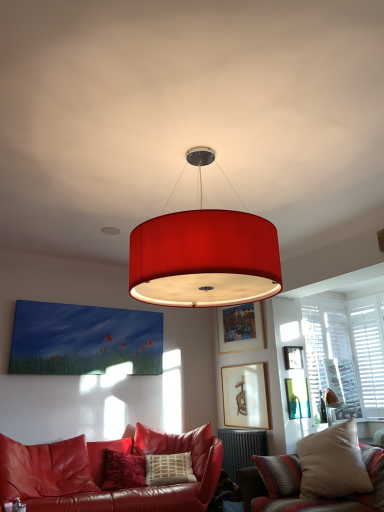
Where is `white wooden shutters at right`? The height and width of the screenshot is (512, 384). white wooden shutters at right is located at coordinates (346, 352).

I want to click on wooden picture frame at upper center, the second picture frame in the top-to-bottom sequence, so click(x=293, y=357).

Find the location of `matte red drum shade at center`. matte red drum shade at center is located at coordinates (204, 255).

From the picture: Considering the relative positions of wooden picture frame at upper center, which is the third picture frame in bottom-to-top order, and wooden picture frame at upper center, the 4th picture frame in the bottom-to-top sequence, in the image provided, is wooden picture frame at upper center, which is the third picture frame in bottom-to-top order, to the left of wooden picture frame at upper center, the 4th picture frame in the bottom-to-top sequence, from the viewer's perspective?

No.

Which of these two, wooden picture frame at upper center, the second picture frame in the top-to-bottom sequence, or wooden picture frame at upper center, the 4th picture frame in the bottom-to-top sequence, stands taller?

wooden picture frame at upper center, the 4th picture frame in the bottom-to-top sequence.

Is wooden picture frame at upper center, the second picture frame in the top-to-bottom sequence, placed right next to wooden picture frame at upper center, the 1th picture frame when ordered from top to bottom?

No, wooden picture frame at upper center, the second picture frame in the top-to-bottom sequence, is not beside wooden picture frame at upper center, the 1th picture frame when ordered from top to bottom.

At what (x,y) coordinates should I click in order to perform the action: click on studio couch that is on the left side of dark gray metallic radiator at lower center. Please return your answer as a coordinate pair (x, y). Image resolution: width=384 pixels, height=512 pixels. Looking at the image, I should click on (102, 474).

From the image's perspective, which one is positioned lower, dark gray metallic radiator at lower center or satin red couch at lower left, which is the 2th studio couch from right to left?

dark gray metallic radiator at lower center.

In terms of size, does dark gray metallic radiator at lower center appear bigger or smaller than satin red couch at lower left, which is the 2th studio couch from right to left?

In the image, dark gray metallic radiator at lower center appears to be smaller than satin red couch at lower left, which is the 2th studio couch from right to left.

Would you say dark gray metallic radiator at lower center contains satin red couch at lower left, the first studio couch in the left-to-right sequence?

Actually, satin red couch at lower left, the first studio couch in the left-to-right sequence, is outside dark gray metallic radiator at lower center.

Is wooden picture frame at upper center, the 1th picture frame when ordered from top to bottom, oriented away from satin red couch at lower left, which is the 2th studio couch from right to left?

wooden picture frame at upper center, the 1th picture frame when ordered from top to bottom, does not have its back to satin red couch at lower left, which is the 2th studio couch from right to left.

Can you confirm if wooden picture frame at upper center, the 1th picture frame when ordered from top to bottom, is positioned to the left of satin red couch at lower left, the first studio couch in the left-to-right sequence?

No.

Considering the relative sizes of wooden picture frame at upper center, the 1th picture frame when ordered from top to bottom, and satin red couch at lower left, which is the 2th studio couch from right to left, in the image provided, is wooden picture frame at upper center, the 1th picture frame when ordered from top to bottom, bigger than satin red couch at lower left, which is the 2th studio couch from right to left,?

Incorrect, wooden picture frame at upper center, the 1th picture frame when ordered from top to bottom, is not larger than satin red couch at lower left, which is the 2th studio couch from right to left.

From a real-world perspective, does wooden picture frame at upper center, the 4th picture frame in the bottom-to-top sequence, stand above satin red couch at lower left, the first studio couch in the left-to-right sequence?

Correct, in the physical world, wooden picture frame at upper center, the 4th picture frame in the bottom-to-top sequence, is higher than satin red couch at lower left, the first studio couch in the left-to-right sequence.

Is matte gold picture frame at upper right, the 3th picture frame when ordered from top to bottom, next to matte wooden picture frame at center, which is counted as the 4th picture frame, starting from the top?

No, matte gold picture frame at upper right, the 3th picture frame when ordered from top to bottom, is not with matte wooden picture frame at center, which is counted as the 4th picture frame, starting from the top.

This screenshot has width=384, height=512. Find the location of `picture frame in front of the matte wooden picture frame at center, which is counted as the 4th picture frame, starting from the top`. picture frame in front of the matte wooden picture frame at center, which is counted as the 4th picture frame, starting from the top is located at coordinates (297, 398).

Considering their positions, is matte gold picture frame at upper right, the 3th picture frame when ordered from top to bottom, located in front of or behind matte wooden picture frame at center, the 1th picture frame in the bottom-to-top sequence?

Clearly, matte gold picture frame at upper right, the 3th picture frame when ordered from top to bottom, is in front of matte wooden picture frame at center, the 1th picture frame in the bottom-to-top sequence.

Could you measure the distance between matte gold picture frame at upper right, which is the 2th picture frame from bottom to top, and matte wooden picture frame at center, which is counted as the 4th picture frame, starting from the top?

They are 17.87 inches apart.

Is wooden picture frame at upper center, which is the third picture frame in bottom-to-top order, at the left side of dark gray metallic radiator at lower center?

In fact, wooden picture frame at upper center, which is the third picture frame in bottom-to-top order, is to the right of dark gray metallic radiator at lower center.

From the image's perspective, is wooden picture frame at upper center, which is the third picture frame in bottom-to-top order, positioned above or below dark gray metallic radiator at lower center?

Based on their image positions, wooden picture frame at upper center, which is the third picture frame in bottom-to-top order, is located above dark gray metallic radiator at lower center.

You are a GUI agent. You are given a task and a screenshot of the screen. Output one action in this format:
    pyautogui.click(x=<x>, y=<y>)
    Task: Click on the 3rd picture frame directly above the dark gray metallic radiator at lower center (from a real-world perspective)
    This screenshot has height=512, width=384.
    Given the screenshot: What is the action you would take?
    pyautogui.click(x=293, y=357)

In terms of width, does wooden picture frame at upper center, the second picture frame in the top-to-bottom sequence, look wider or thinner when compared to dark gray metallic radiator at lower center?

wooden picture frame at upper center, the second picture frame in the top-to-bottom sequence, is thinner than dark gray metallic radiator at lower center.

Is point (340, 321) positioned before point (235, 349)?

No, (340, 321) is behind (235, 349).

Between white wooden shutters at right and wooden picture frame at upper center, the 1th picture frame when ordered from top to bottom, which one has larger width?

white wooden shutters at right.

Identify the location of window below the wooden picture frame at upper center, the 1th picture frame when ordered from top to bottom (from a real-world perspective). The image size is (384, 512). (346, 352).

Can you confirm if white wooden shutters at right is positioned to the right of wooden picture frame at upper center, the 1th picture frame when ordered from top to bottom?

Indeed, white wooden shutters at right is positioned on the right side of wooden picture frame at upper center, the 1th picture frame when ordered from top to bottom.

From a real-world perspective, is wooden picture frame at upper center, the 4th picture frame in the bottom-to-top sequence, physically above matte gold picture frame at upper right, the 3th picture frame when ordered from top to bottom?

Indeed, from a real-world perspective, wooden picture frame at upper center, the 4th picture frame in the bottom-to-top sequence, stands above matte gold picture frame at upper right, the 3th picture frame when ordered from top to bottom.

Considering the relative positions of wooden picture frame at upper center, the 1th picture frame when ordered from top to bottom, and matte gold picture frame at upper right, which is the 2th picture frame from bottom to top, in the image provided, is wooden picture frame at upper center, the 1th picture frame when ordered from top to bottom, in front of matte gold picture frame at upper right, which is the 2th picture frame from bottom to top,?

No, the depth of wooden picture frame at upper center, the 1th picture frame when ordered from top to bottom, is greater than that of matte gold picture frame at upper right, which is the 2th picture frame from bottom to top.

Is point (258, 312) positioned in front of point (293, 392)?

No, it is behind (293, 392).

You are a GUI agent. You are given a task and a screenshot of the screen. Output one action in this format:
    pyautogui.click(x=<x>, y=<y>)
    Task: Click on the 1st picture frame positioned below the wooden picture frame at upper center, the 4th picture frame in the bottom-to-top sequence (from a real-world perspective)
    
    Given the screenshot: What is the action you would take?
    pyautogui.click(x=293, y=357)

Identify the location of radiator located behind the satin red couch at lower left, the first studio couch in the left-to-right sequence. Image resolution: width=384 pixels, height=512 pixels. (241, 448).

Considering their positions, is matte gold picture frame at upper right, which is the 2th picture frame from bottom to top, positioned further to white wooden shutters at right than velvet beige pillow at lower right, the second studio couch viewed from the left?

velvet beige pillow at lower right, the second studio couch viewed from the left, is positioned further to the anchor white wooden shutters at right.

Considering their positions, is wooden picture frame at upper center, the second picture frame in the top-to-bottom sequence, positioned further to dark gray metallic radiator at lower center than matte gold picture frame at upper right, the 3th picture frame when ordered from top to bottom?

Based on the image, wooden picture frame at upper center, the second picture frame in the top-to-bottom sequence, appears to be further to dark gray metallic radiator at lower center.

When comparing their distances from white wooden shutters at right, does matte gold picture frame at upper right, the 3th picture frame when ordered from top to bottom, or wooden picture frame at upper center, the 1th picture frame when ordered from top to bottom, seem further?

Based on the image, wooden picture frame at upper center, the 1th picture frame when ordered from top to bottom, appears to be further to white wooden shutters at right.

When comparing their distances from white wooden shutters at right, does matte wooden picture frame at center, which is counted as the 4th picture frame, starting from the top, or dark gray metallic radiator at lower center seem closer?

matte wooden picture frame at center, which is counted as the 4th picture frame, starting from the top, is closer to white wooden shutters at right.

Based on their spatial positions, is matte gold picture frame at upper right, the 3th picture frame when ordered from top to bottom, or dark gray metallic radiator at lower center closer to wooden picture frame at upper center, the second picture frame in the top-to-bottom sequence?

matte gold picture frame at upper right, the 3th picture frame when ordered from top to bottom, is positioned closer to the anchor wooden picture frame at upper center, the second picture frame in the top-to-bottom sequence.

Which object lies further to the anchor point matte wooden picture frame at center, which is counted as the 4th picture frame, starting from the top, matte gold picture frame at upper right, which is the 2th picture frame from bottom to top, or wooden picture frame at upper center, the 1th picture frame when ordered from top to bottom?

wooden picture frame at upper center, the 1th picture frame when ordered from top to bottom.

Estimate the real-world distances between objects in this image. Which object is closer to velvet beige pillow at lower right, the second studio couch viewed from the left, dark gray metallic radiator at lower center or matte gold picture frame at upper right, the 3th picture frame when ordered from top to bottom?

dark gray metallic radiator at lower center.

Estimate the real-world distances between objects in this image. Which object is closer to satin red couch at lower left, which is the 2th studio couch from right to left, velvet beige pillow at lower right, which ranks as the first studio couch in right-to-left order, or white wooden shutters at right?

velvet beige pillow at lower right, which ranks as the first studio couch in right-to-left order, is closer to satin red couch at lower left, which is the 2th studio couch from right to left.

Locate an element on the screen. This screenshot has width=384, height=512. studio couch between satin red couch at lower left, which is the 2th studio couch from right to left, and wooden picture frame at upper center, the second picture frame in the top-to-bottom sequence, from left to right is located at coordinates (318, 475).

You are a GUI agent. You are given a task and a screenshot of the screen. Output one action in this format:
    pyautogui.click(x=<x>, y=<y>)
    Task: Click on the studio couch located between velvet beige pillow at lower right, the second studio couch viewed from the left, and wooden picture frame at upper center, the 4th picture frame in the bottom-to-top sequence, in the depth direction
    This screenshot has height=512, width=384.
    Given the screenshot: What is the action you would take?
    pyautogui.click(x=102, y=474)

Find the location of a particular element. studio couch located between satin red couch at lower left, which is the 2th studio couch from right to left, and matte gold picture frame at upper right, the 3th picture frame when ordered from top to bottom, in the left-right direction is located at coordinates (318, 475).

The width and height of the screenshot is (384, 512). I want to click on picture frame between wooden picture frame at upper center, the 1th picture frame when ordered from top to bottom, and matte gold picture frame at upper right, the 3th picture frame when ordered from top to bottom, vertically, so click(293, 357).